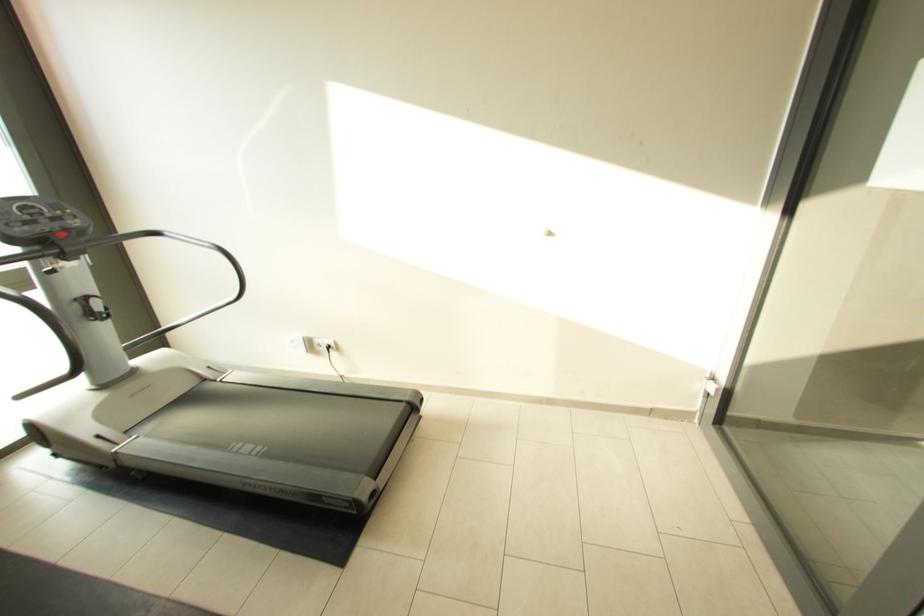
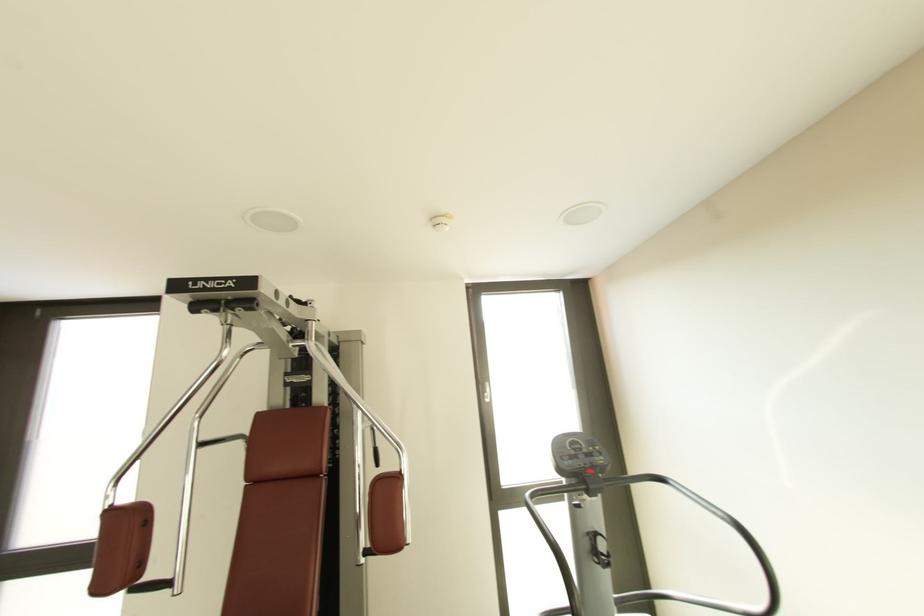
Based on the continuous images, in which direction is the camera rotating?

The camera rotated toward left-up.